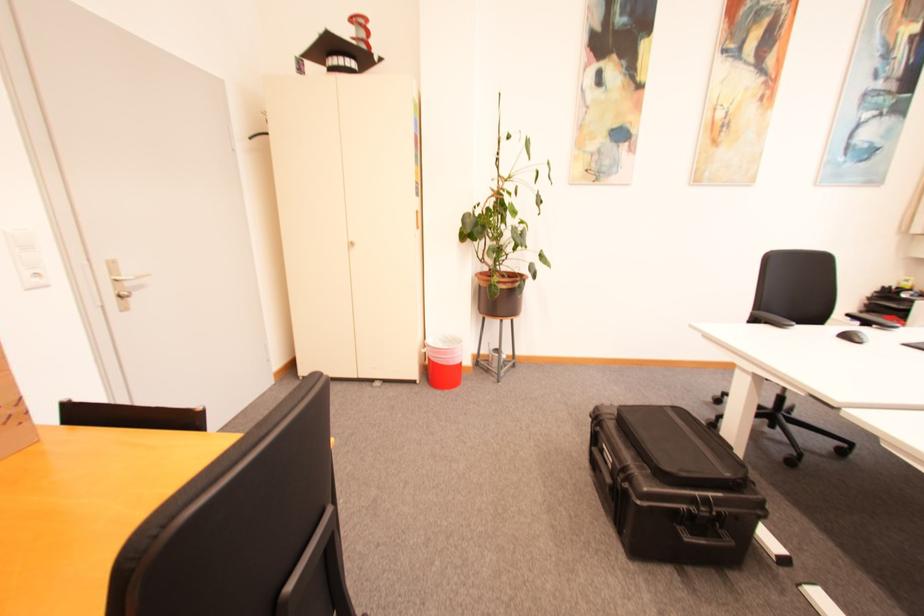
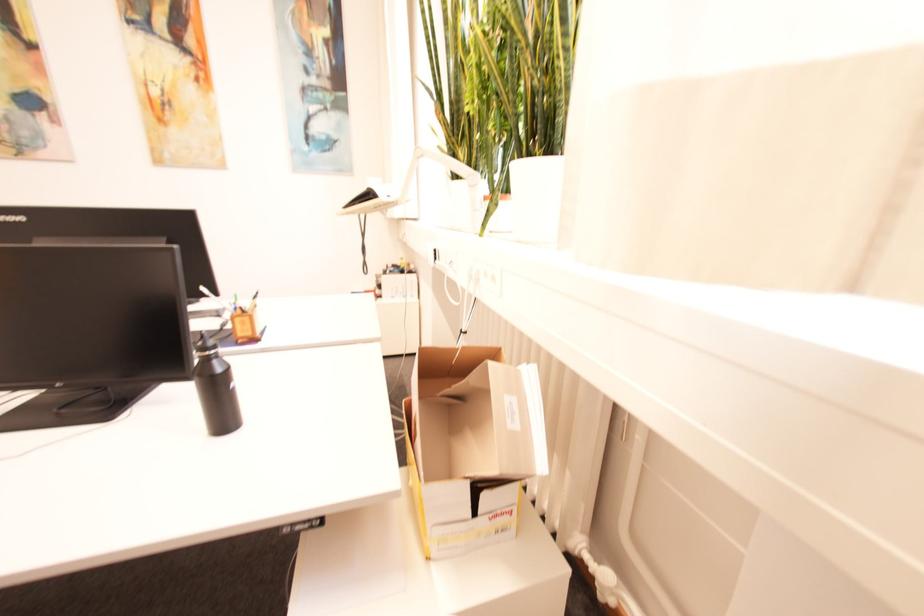
Question: Which direction would the cameraman need to move to produce the second image? Reply with the corresponding letter.

Choices:
 (A) Left
 (B) Right
 (C) Forward
 (D) Backward

Answer: (B)